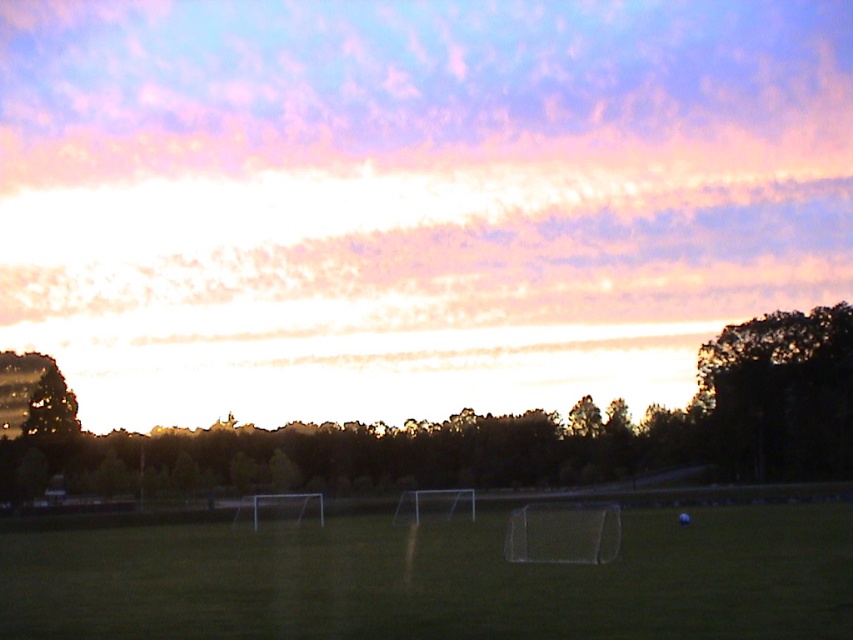
Does dark green leafy tree at center appear on the right side of dark green leafy tree at right?

Incorrect, dark green leafy tree at center is not on the right side of dark green leafy tree at right.

Which is below, dark green leafy tree at center or dark green leafy tree at right?

dark green leafy tree at center is below.

Between point (747, 468) and point (846, 369), which one is positioned behind?

Positioned behind is point (846, 369).

Locate an element on the screen. dark green leafy tree at center is located at coordinates (489, 433).

Does green grass at center appear on the right side of dark green leafy tree at right?

In fact, green grass at center is to the left of dark green leafy tree at right.

Can you confirm if green grass at center is positioned to the left of dark green leafy tree at right?

Yes, green grass at center is to the left of dark green leafy tree at right.

Which is behind, point (370, 576) or point (757, 344)?

Point (757, 344)

You are a GUI agent. You are given a task and a screenshot of the screen. Output one action in this format:
    pyautogui.click(x=<x>, y=<y>)
    Task: Click on the green grass at center
    The image size is (853, 640).
    Given the screenshot: What is the action you would take?
    click(x=436, y=580)

Can you confirm if green grass at center is thinner than dark green leafy tree at center?

Yes, green grass at center is thinner than dark green leafy tree at center.

Who is more distant from viewer, (x=489, y=588) or (x=666, y=452)?

Point (x=666, y=452)

Where is `green grass at center`? green grass at center is located at coordinates (436, 580).